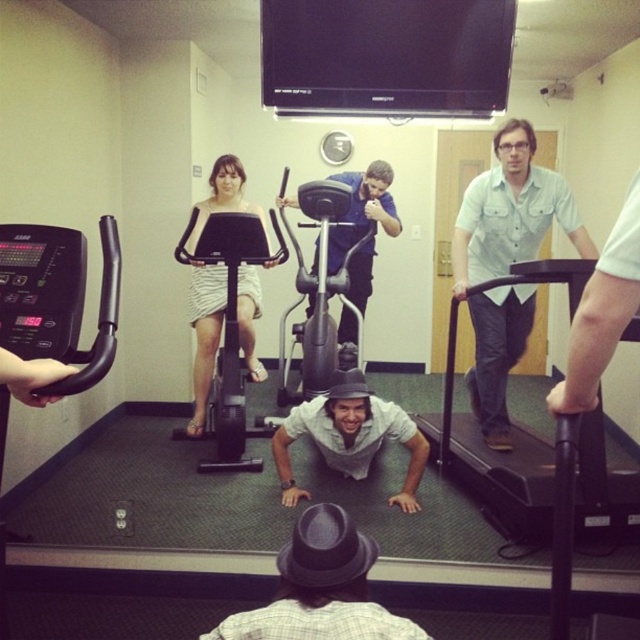
Is gray felt fedora at center taller than gray cotton shirt at center?

No, gray felt fedora at center is not taller than gray cotton shirt at center.

Is gray felt fedora at center to the right of gray cotton shirt at center from the viewer's perspective?

In fact, gray felt fedora at center is to the left of gray cotton shirt at center.

Image resolution: width=640 pixels, height=640 pixels. Describe the element at coordinates (321, 588) in the screenshot. I see `gray felt fedora at center` at that location.

The image size is (640, 640). In order to click on gray felt fedora at center in this screenshot , I will do `click(321, 588)`.

In the scene shown: Can you confirm if black rubber treadmill at right is wider than gray cotton shirt at center?

Correct, the width of black rubber treadmill at right exceeds that of gray cotton shirt at center.

Can you confirm if black rubber treadmill at right is bigger than gray cotton shirt at center?

Yes, black rubber treadmill at right is bigger than gray cotton shirt at center.

Image resolution: width=640 pixels, height=640 pixels. What are the coordinates of `black rubber treadmill at right` in the screenshot? It's located at (493, 465).

Between light blue shirt at center and white textured dress at center, which one appears on the right side from the viewer's perspective?

light blue shirt at center

Is light blue shirt at center positioned before white textured dress at center?

Yes, light blue shirt at center is in front of white textured dress at center.

Locate an element on the screen. The height and width of the screenshot is (640, 640). light blue shirt at center is located at coordinates 509,211.